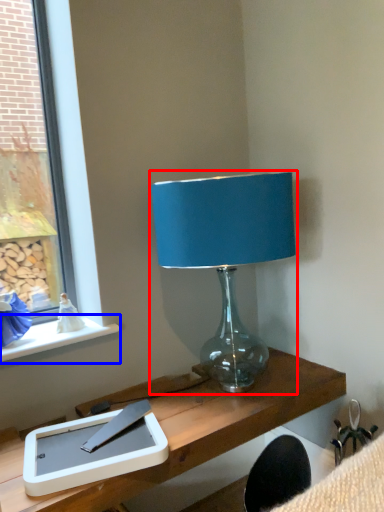
Question: Which object is closer to the camera taking this photo, lamp (highlighted by a red box) or window sill (highlighted by a blue box)?

Choices:
 (A) lamp
 (B) window sill

Answer: (A)